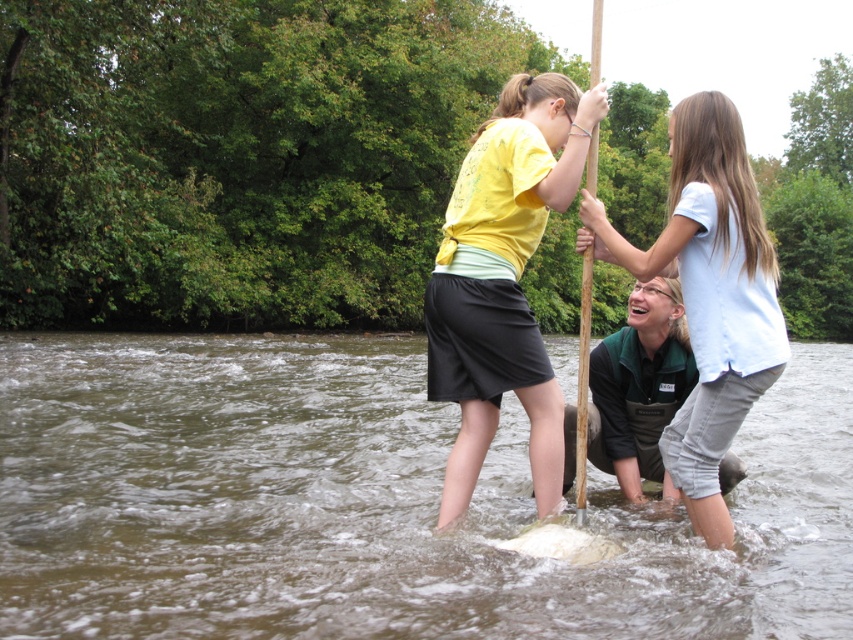
Question: Based on their relative distances, which object is farther from the brown wood paddle at center?

Choices:
 (A) white cotton shirt at upper center
 (B) brown muddy water at center
 (C) yellow matte shirt at center

Answer: (A)

Question: Is yellow matte shirt at center to the right of white cotton shirt at upper center from the viewer's perspective?

Choices:
 (A) no
 (B) yes

Answer: (A)

Question: Considering the real-world distances, which object is closest to the brown wood paddle at center?

Choices:
 (A) yellow matte shirt at center
 (B) white cotton shirt at upper center

Answer: (A)

Question: Can you confirm if yellow matte shirt at center is bigger than brown wood paddle at center?

Choices:
 (A) yes
 (B) no

Answer: (B)

Question: Is yellow matte shirt at center to the right of white cotton shirt at upper center from the viewer's perspective?

Choices:
 (A) no
 (B) yes

Answer: (A)

Question: Which point is closer to the camera?

Choices:
 (A) yellow matte shirt at center
 (B) brown wood paddle at center

Answer: (A)